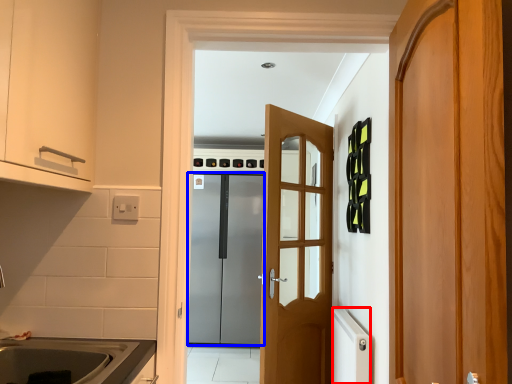
Question: Which object appears farthest to the camera in this image, appliance (highlighted by a red box) or door (highlighted by a blue box)?

Choices:
 (A) appliance
 (B) door

Answer: (B)